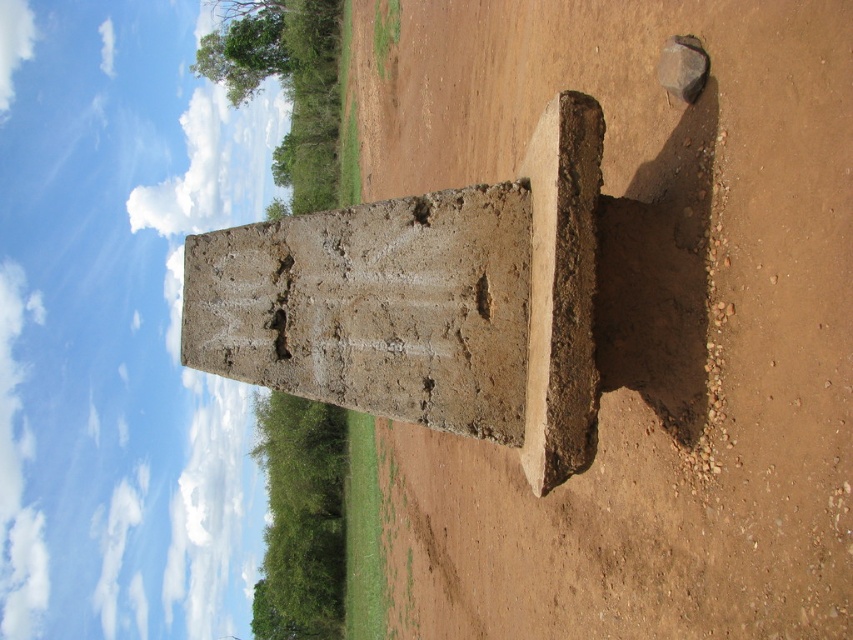
You are a construction worker needing to place a 5 meter long steel beam between the brown dirt at center and the gray concrete pillar at center. Can you fit the beam between them without bending it?

The distance between the brown dirt at center and the gray concrete pillar at center is 4.56 meters, so the 5 meter long steel beam is longer than the available space. It cannot be placed without bending.

You are a construction worker inspecting the site. You notice the brown dirt at center and the gray concrete pillar at center. Which object is located to the right of the other?

The brown dirt at center is positioned on the right side of the gray concrete pillar at center, so the brown dirt at center is to the right of the gray concrete pillar at center.

You are a surveyor analyzing a construction site. You need to mark the exact center point of the brown dirt at center. What are the coordinates of this point?

The coordinates of the brown dirt at center are at point (640, 321).